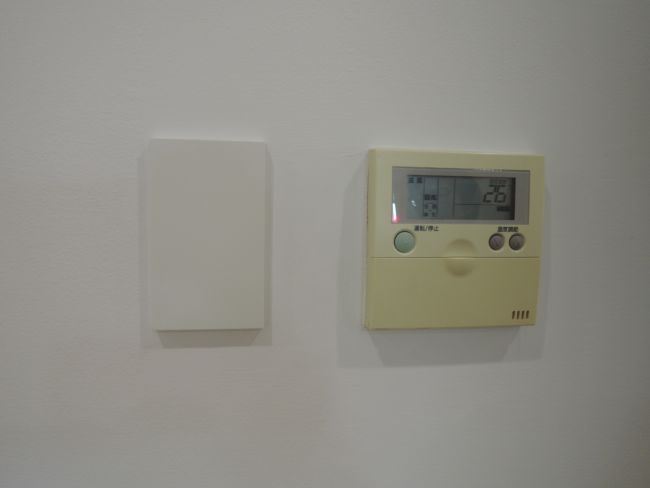
I want to click on thermostat, so click(x=452, y=195).